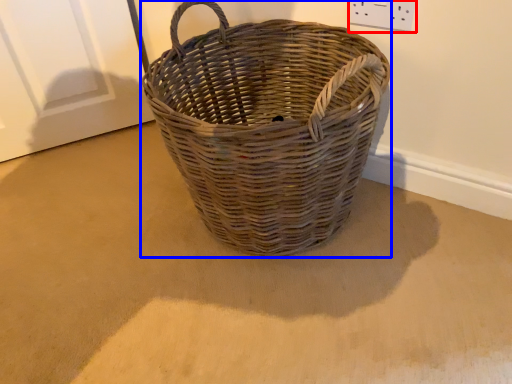
Question: Among these objects, which one is nearest to the camera, electric outlet (highlighted by a red box) or picnic basket (highlighted by a blue box)?

Choices:
 (A) electric outlet
 (B) picnic basket

Answer: (B)